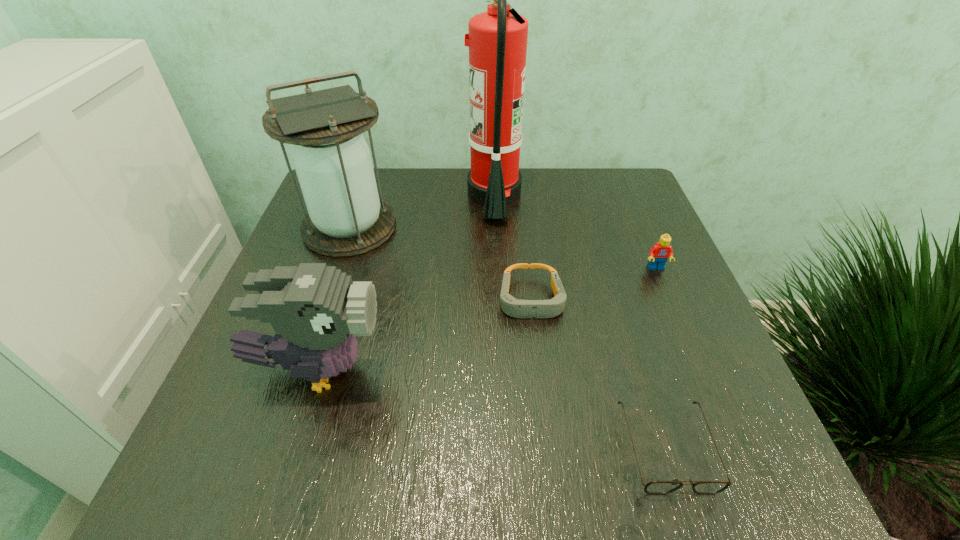
Image resolution: width=960 pixels, height=540 pixels. Find the location of `bird that is at the left edge`. bird that is at the left edge is located at coordinates (316, 311).

This screenshot has width=960, height=540. I want to click on Lego at the right edge, so click(659, 253).

This screenshot has height=540, width=960. I want to click on sunglasses present at the right edge, so click(654, 487).

At what (x,y) coordinates should I click in order to perform the action: click on object at the far left corner. Please return your answer as a coordinate pair (x, y). Looking at the image, I should click on (332, 160).

Where is `object situated at the near right corner`? The image size is (960, 540). object situated at the near right corner is located at coordinates (654, 487).

Locate an element on the screen. The height and width of the screenshot is (540, 960). vacant region at the far edge of the desktop is located at coordinates (404, 198).

The width and height of the screenshot is (960, 540). In order to click on free space at the near edge of the desktop in this screenshot , I will do click(x=567, y=464).

This screenshot has width=960, height=540. I want to click on vacant space at the left edge of the desktop, so click(293, 253).

Locate an element on the screen. This screenshot has height=540, width=960. vacant area at the right edge is located at coordinates (660, 319).

Where is `free space at the far right corner`? free space at the far right corner is located at coordinates [617, 188].